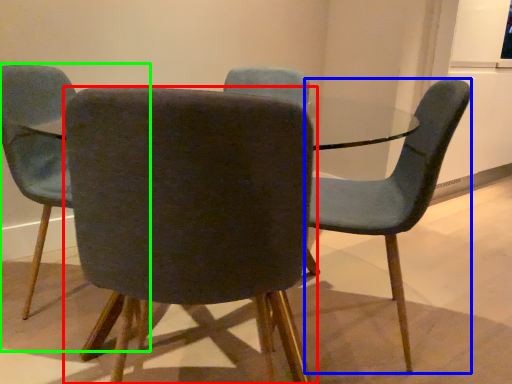
Question: Which is nearer to the chair (highlighted by a red box)? chair (highlighted by a blue box) or chair (highlighted by a green box).

Choices:
 (A) chair
 (B) chair

Answer: (A)